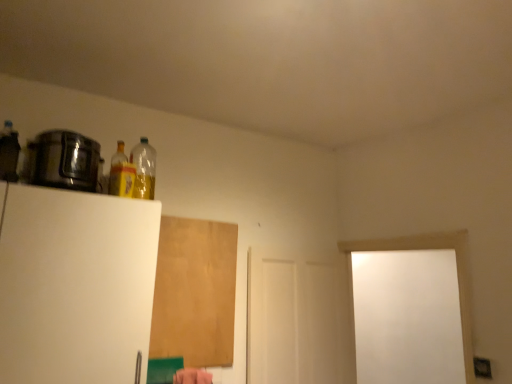
Question: Is translucent yellow bottle at upper left, arranged as the 2th bottle when viewed from the right, shorter than white matte door at right?

Choices:
 (A) no
 (B) yes

Answer: (B)

Question: Is translucent yellow bottle at upper left, which is the 2th bottle in back-to-front order, turned away from white matte door at right?

Choices:
 (A) yes
 (B) no

Answer: (B)

Question: Is translucent yellow bottle at upper left, which is the 2th bottle in back-to-front order, facing towards white matte door at right?

Choices:
 (A) no
 (B) yes

Answer: (A)

Question: Is the depth of translucent yellow bottle at upper left, arranged as the 2th bottle when viewed from the right, greater than that of white matte door at right?

Choices:
 (A) no
 (B) yes

Answer: (A)

Question: Does translucent yellow bottle at upper left, arranged as the second bottle when viewed from the left, touch white matte door at right?

Choices:
 (A) no
 (B) yes

Answer: (A)

Question: Considering the relative sizes of translucent yellow bottle at upper left, arranged as the second bottle when viewed from the left, and white matte door at right in the image provided, is translucent yellow bottle at upper left, arranged as the second bottle when viewed from the left, bigger than white matte door at right?

Choices:
 (A) yes
 (B) no

Answer: (B)

Question: Does translucent plastic bottle at upper left, the 3th bottle when ordered from left to right, appear on the left side of brown matte plywood at upper center?

Choices:
 (A) yes
 (B) no

Answer: (A)

Question: Considering the relative sizes of translucent plastic bottle at upper left, acting as the 3th bottle starting from the front, and brown matte plywood at upper center in the image provided, is translucent plastic bottle at upper left, acting as the 3th bottle starting from the front, taller than brown matte plywood at upper center?

Choices:
 (A) no
 (B) yes

Answer: (A)

Question: Is translucent plastic bottle at upper left, the 3th bottle when ordered from left to right, positioned before brown matte plywood at upper center?

Choices:
 (A) yes
 (B) no

Answer: (A)

Question: Could you tell me if translucent plastic bottle at upper left, which is counted as the 1th bottle, starting from the right, is facing brown matte plywood at upper center?

Choices:
 (A) no
 (B) yes

Answer: (A)

Question: Is translucent plastic bottle at upper left, which is counted as the 1th bottle, starting from the right, not inside brown matte plywood at upper center?

Choices:
 (A) no
 (B) yes

Answer: (B)

Question: Does translucent plastic bottle at upper left, the 3th bottle when ordered from left to right, have a larger size compared to brown matte plywood at upper center?

Choices:
 (A) no
 (B) yes

Answer: (A)

Question: Is white matte door at center further to the viewer compared to white matte door at right?

Choices:
 (A) yes
 (B) no

Answer: (A)